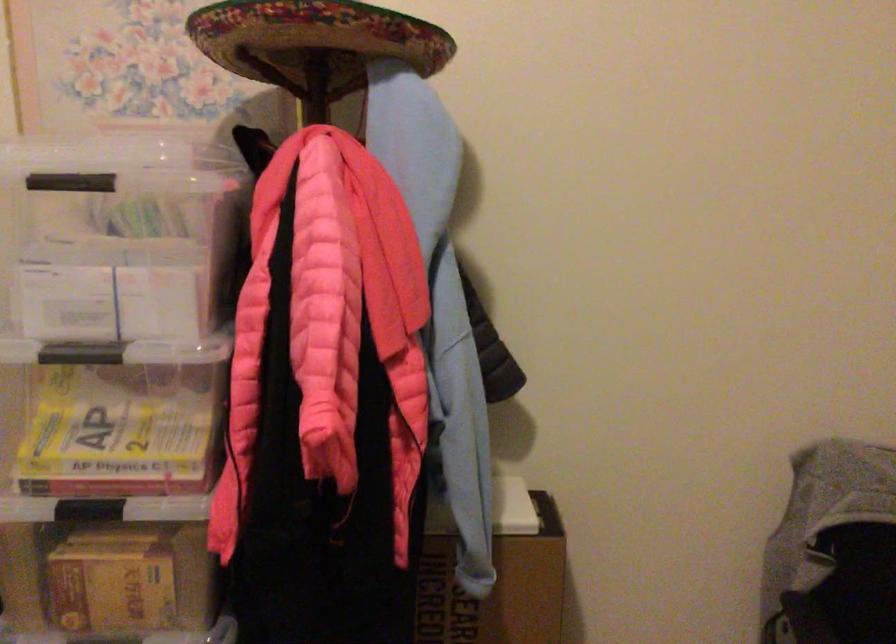
Locate an element on the screen. Image resolution: width=896 pixels, height=644 pixels. yellow physics book is located at coordinates (119, 430).